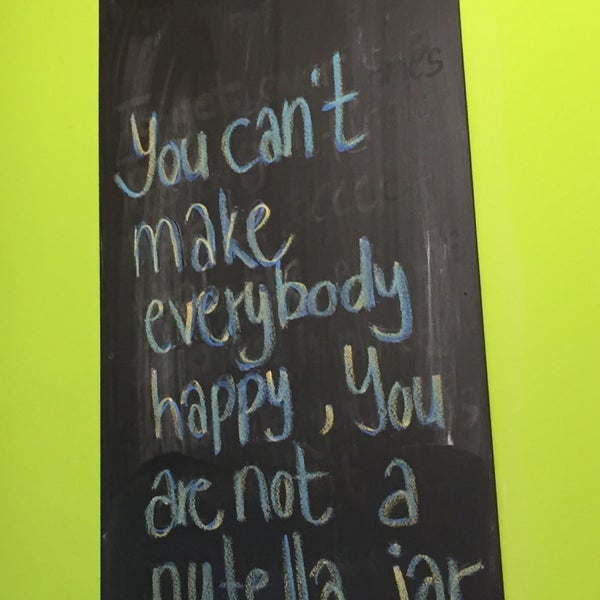
The height and width of the screenshot is (600, 600). Identify the location of wall. (534, 265).